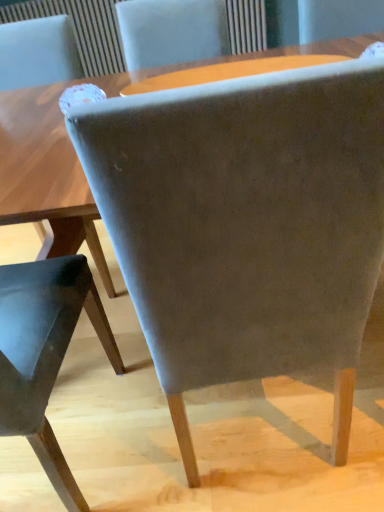
Question: Can you confirm if suede-like gray chair at center, the 2th chair viewed from the left, is positioned to the right of suede gray chair at center, the first chair viewed from the left?

Choices:
 (A) no
 (B) yes

Answer: (B)

Question: Can you confirm if suede-like gray chair at center, the 2th chair viewed from the left, is wider than suede gray chair at center, the first chair viewed from the left?

Choices:
 (A) yes
 (B) no

Answer: (A)

Question: Is suede-like gray chair at center, which is counted as the 1th chair, starting from the right, positioned behind suede gray chair at center, the second chair positioned from the right?

Choices:
 (A) yes
 (B) no

Answer: (B)

Question: Considering the relative sizes of suede-like gray chair at center, the 2th chair viewed from the left, and suede gray chair at center, the second chair positioned from the right, in the image provided, is suede-like gray chair at center, the 2th chair viewed from the left, shorter than suede gray chair at center, the second chair positioned from the right,?

Choices:
 (A) no
 (B) yes

Answer: (A)

Question: Is suede-like gray chair at center, which is counted as the 1th chair, starting from the right, facing towards suede gray chair at center, the first chair viewed from the left?

Choices:
 (A) yes
 (B) no

Answer: (B)

Question: From the image's perspective, is suede-like gray chair at center, which is counted as the 1th chair, starting from the right, below suede gray chair at center, the first chair viewed from the left?

Choices:
 (A) no
 (B) yes

Answer: (A)

Question: Considering the relative sizes of suede gray chair at center, the first chair viewed from the left, and matte wooden table at upper center in the image provided, is suede gray chair at center, the first chair viewed from the left, shorter than matte wooden table at upper center?

Choices:
 (A) yes
 (B) no

Answer: (B)

Question: Is suede gray chair at center, the second chair positioned from the right, oriented away from matte wooden table at upper center?

Choices:
 (A) yes
 (B) no

Answer: (B)

Question: Is suede gray chair at center, the second chair positioned from the right, completely or partially outside of matte wooden table at upper center?

Choices:
 (A) no
 (B) yes

Answer: (B)

Question: From the image's perspective, does suede gray chair at center, the first chair viewed from the left, appear higher than matte wooden table at upper center?

Choices:
 (A) yes
 (B) no

Answer: (B)

Question: Could you tell me if suede gray chair at center, the second chair positioned from the right, is facing matte wooden table at upper center?

Choices:
 (A) yes
 (B) no

Answer: (B)

Question: Is suede gray chair at center, the second chair positioned from the right, bigger than matte wooden table at upper center?

Choices:
 (A) no
 (B) yes

Answer: (B)

Question: Does suede-like gray chair at center, which is counted as the 1th chair, starting from the right, lie behind matte wooden table at upper center?

Choices:
 (A) no
 (B) yes

Answer: (A)